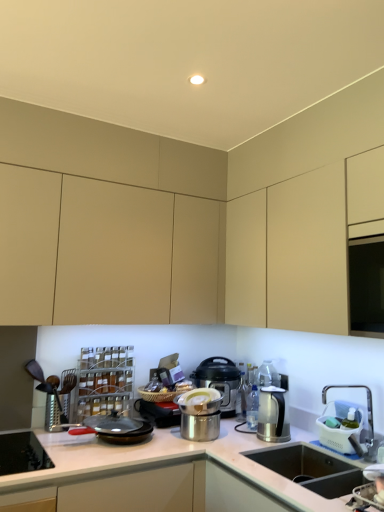
Identify the location of vacant space in front of black non-stick frying pan at center. (88, 457).